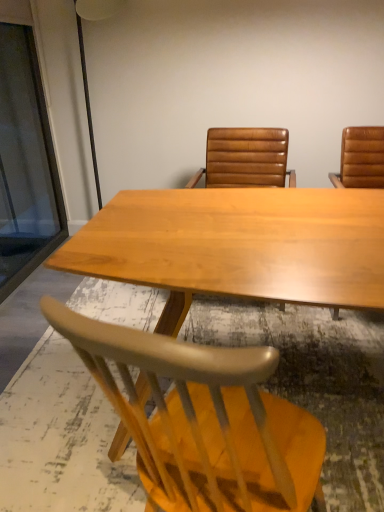
At what (x,y) coordinates should I click in order to perform the action: click on light brown wood table at center. Please return your answer as a coordinate pair (x, y). This screenshot has width=384, height=512. Looking at the image, I should click on (238, 246).

Image resolution: width=384 pixels, height=512 pixels. Describe the element at coordinates (25, 163) in the screenshot. I see `transparent glass door at left` at that location.

Locate an element on the screen. The height and width of the screenshot is (512, 384). light wood chair at lower center, positioned as the 2th chair in top-to-bottom order is located at coordinates (202, 419).

This screenshot has width=384, height=512. I want to click on light brown wood table at center, so click(x=238, y=246).

This screenshot has height=512, width=384. Find the location of `chair to the left of leather at center, acting as the 1th chair starting from the top`. chair to the left of leather at center, acting as the 1th chair starting from the top is located at coordinates (202, 419).

Is leather at center, acting as the 1th chair starting from the top, facing towards light wood chair at lower center, the first chair from the bottom?

Yes.

Is leather at center, acting as the 1th chair starting from the top, completely or partially outside of light wood chair at lower center, the first chair from the bottom?

Yes, leather at center, acting as the 1th chair starting from the top, is located beyond the bounds of light wood chair at lower center, the first chair from the bottom.

Is light wood chair at lower center, positioned as the 2th chair in top-to-bottom order, not close to transparent glass door at left?

That's right, there is a large distance between light wood chair at lower center, positioned as the 2th chair in top-to-bottom order, and transparent glass door at left.

From the image's perspective, which one is positioned higher, light wood chair at lower center, the first chair from the bottom, or transparent glass door at left?

transparent glass door at left, from the image's perspective.

In terms of height, does light wood chair at lower center, the first chair from the bottom, look taller or shorter compared to transparent glass door at left?

Considering their sizes, light wood chair at lower center, the first chair from the bottom, has less height than transparent glass door at left.

From the picture: Is transparent glass door at left at the back of light wood chair at lower center, the first chair from the bottom?

light wood chair at lower center, the first chair from the bottom, is not turned away from transparent glass door at left.

From a real-world perspective, which is physically below, light brown wood table at center or transparent glass door at left?

light brown wood table at center is physically lower.

Can you tell me how much light brown wood table at center and transparent glass door at left differ in facing direction?

90.9 degrees separate the facing orientations of light brown wood table at center and transparent glass door at left.

From the picture: Does light brown wood table at center have a smaller size compared to transparent glass door at left?

Actually, light brown wood table at center might be larger than transparent glass door at left.

Which is less distant, (154, 223) or (59, 221)?

The point (154, 223) is closer.

Who is taller, transparent glass door at left or leather at center, the 2th chair from the bottom?

Standing taller between the two is transparent glass door at left.

From the image's perspective, who appears lower, transparent glass door at left or leather at center, acting as the 1th chair starting from the top?

From the image's view, leather at center, acting as the 1th chair starting from the top, is below.

Can you tell me how much transparent glass door at left and leather at center, acting as the 1th chair starting from the top, differ in facing direction?

93.6 degrees.

Who is smaller, transparent glass door at left or leather at center, acting as the 1th chair starting from the top?

Smaller between the two is transparent glass door at left.

From the image's perspective, is transparent glass door at left located beneath light brown wood table at center?

Incorrect, from the image's perspective, transparent glass door at left is higher than light brown wood table at center.

From a real-world perspective, is transparent glass door at left positioned over light brown wood table at center based on gravity?

Indeed, from a real-world perspective, transparent glass door at left stands above light brown wood table at center.

Is point (18, 60) less distant than point (162, 280)?

No, (18, 60) is further to viewer.

From the picture: Is transparent glass door at left positioned with its back to light brown wood table at center?

transparent glass door at left is not turned away from light brown wood table at center.

Does light wood chair at lower center, positioned as the 2th chair in top-to-bottom order, lie behind light brown wood table at center?

Yes.

This screenshot has width=384, height=512. I want to click on chair on the left of light brown wood table at center, so click(x=202, y=419).

Which is farther, [118,397] or [208,188]?

The point [208,188] is more distant.

In the scene shown: From a real-world perspective, who is located lower, light wood chair at lower center, the first chair from the bottom, or leather at center, the 2th chair from the bottom?

light wood chair at lower center, the first chair from the bottom, is physically lower.

Is light wood chair at lower center, the first chair from the bottom, inside or outside of leather at center, acting as the 1th chair starting from the top?

light wood chair at lower center, the first chair from the bottom, cannot be found inside leather at center, acting as the 1th chair starting from the top.

Is point (220, 351) closer or farther from the camera than point (256, 161)?

Point (220, 351) is closer to the camera than point (256, 161).

Between light wood chair at lower center, the first chair from the bottom, and leather at center, the 2th chair from the bottom, which one has less height?

light wood chair at lower center, the first chair from the bottom.

Locate an element on the screen. chair located on the right of light wood chair at lower center, positioned as the 2th chair in top-to-bottom order is located at coordinates (245, 158).

The width and height of the screenshot is (384, 512). I want to click on glass door above the light wood chair at lower center, positioned as the 2th chair in top-to-bottom order (from a real-world perspective), so click(25, 163).

From the image, which object appears to be farther from light brown wood table at center, light wood chair at lower center, positioned as the 2th chair in top-to-bottom order, or transparent glass door at left?

Among the two, transparent glass door at left is located further to light brown wood table at center.

From the picture: When comparing their distances from light brown wood table at center, does leather at center, the 2th chair from the bottom, or transparent glass door at left seem further?

transparent glass door at left is further to light brown wood table at center.

Based on their spatial positions, is leather at center, the 2th chair from the bottom, or light wood chair at lower center, positioned as the 2th chair in top-to-bottom order, further from light brown wood table at center?

Among the two, leather at center, the 2th chair from the bottom, is located further to light brown wood table at center.

Estimate the real-world distances between objects in this image. Which object is closer to leather at center, the 2th chair from the bottom, transparent glass door at left or light wood chair at lower center, the first chair from the bottom?

transparent glass door at left lies closer to leather at center, the 2th chair from the bottom, than the other object.

When comparing their distances from transparent glass door at left, does leather at center, the 2th chair from the bottom, or light wood chair at lower center, positioned as the 2th chair in top-to-bottom order, seem further?

light wood chair at lower center, positioned as the 2th chair in top-to-bottom order.

Estimate the real-world distances between objects in this image. Which object is further from light wood chair at lower center, the first chair from the bottom, light brown wood table at center or leather at center, acting as the 1th chair starting from the top?

leather at center, acting as the 1th chair starting from the top, lies further to light wood chair at lower center, the first chair from the bottom, than the other object.

Estimate the real-world distances between objects in this image. Which object is closer to light wood chair at lower center, the first chair from the bottom, leather at center, acting as the 1th chair starting from the top, or light brown wood table at center?

light brown wood table at center lies closer to light wood chair at lower center, the first chair from the bottom, than the other object.

Which object lies nearer to the anchor point transparent glass door at left, light wood chair at lower center, positioned as the 2th chair in top-to-bottom order, or leather at center, acting as the 1th chair starting from the top?

leather at center, acting as the 1th chair starting from the top, lies closer to transparent glass door at left than the other object.

You are a GUI agent. You are given a task and a screenshot of the screen. Output one action in this format:
    pyautogui.click(x=<x>, y=<y>)
    Task: Click on the chair between transparent glass door at left and light brown wood table at center
    Image resolution: width=384 pixels, height=512 pixels.
    Given the screenshot: What is the action you would take?
    pyautogui.click(x=202, y=419)

This screenshot has height=512, width=384. In order to click on chair between transparent glass door at left and leather at center, the 2th chair from the bottom in this screenshot , I will do `click(202, 419)`.

Where is `chair between light brown wood table at center and leather at center, the 2th chair from the bottom, along the z-axis`? chair between light brown wood table at center and leather at center, the 2th chair from the bottom, along the z-axis is located at coordinates (202, 419).

Locate an element on the screen. table situated between transparent glass door at left and leather at center, the 2th chair from the bottom, from left to right is located at coordinates (238, 246).